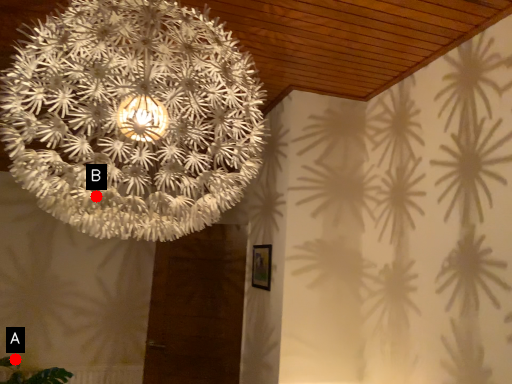
Question: Two points are circled on the image, labeled by A and B beside each circle. Which point appears closest to the camera in this image?

Choices:
 (A) A is closer
 (B) B is closer

Answer: (B)